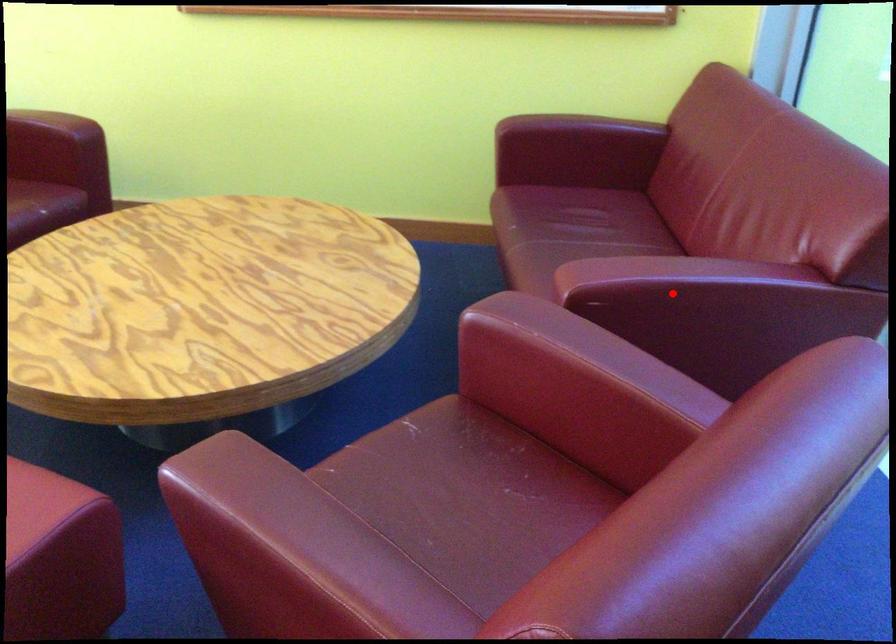
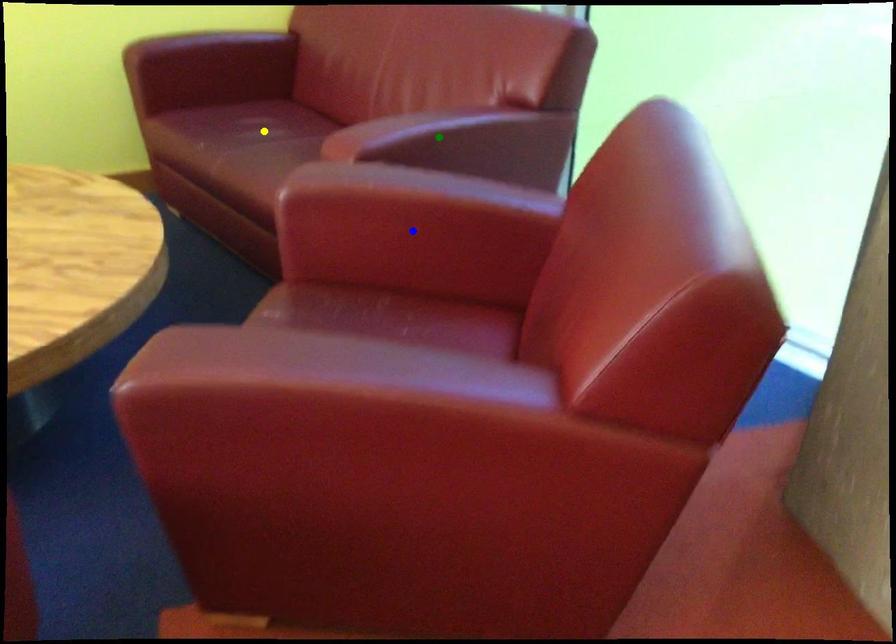
Question: I am providing you with two images of the same scene from different viewpoints. A red point is marked on the first image. You are given multiple points on the second image. Which mark in image 2 goes with the point in image 1?

Choices:
 (A) yellow point
 (B) green point
 (C) blue point

Answer: (B)